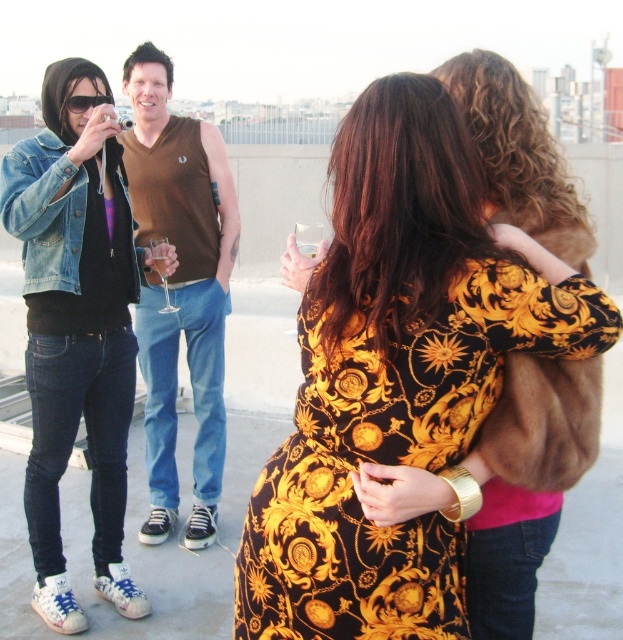
Can you confirm if brown sleeveless shirt at center is smaller than clear glass wine glass at center?

Incorrect, brown sleeveless shirt at center is not smaller in size than clear glass wine glass at center.

Is the position of brown sleeveless shirt at center more distant than that of clear glass wine glass at center?

No, brown sleeveless shirt at center is closer to the viewer.

This screenshot has width=623, height=640. What are the coordinates of `brown sleeveless shirt at center` in the screenshot? It's located at (181, 288).

Is point (313, 321) farther from camera compared to point (163, 284)?

No, it is in front of (163, 284).

Does gold-patterned dress at center come behind clear glass wine glass at center?

No, it is in front of clear glass wine glass at center.

What are the coordinates of `gold-patterned dress at center` in the screenshot? It's located at (397, 378).

Does gold-patterned dress at center appear under denim jacket at left?

Yes.

Image resolution: width=623 pixels, height=640 pixels. Describe the element at coordinates (397, 378) in the screenshot. I see `gold-patterned dress at center` at that location.

Is point (449, 451) positioned before point (49, 296)?

Yes, it is in front of point (49, 296).

Image resolution: width=623 pixels, height=640 pixels. In order to click on gold-patterned dress at center in this screenshot , I will do `click(397, 378)`.